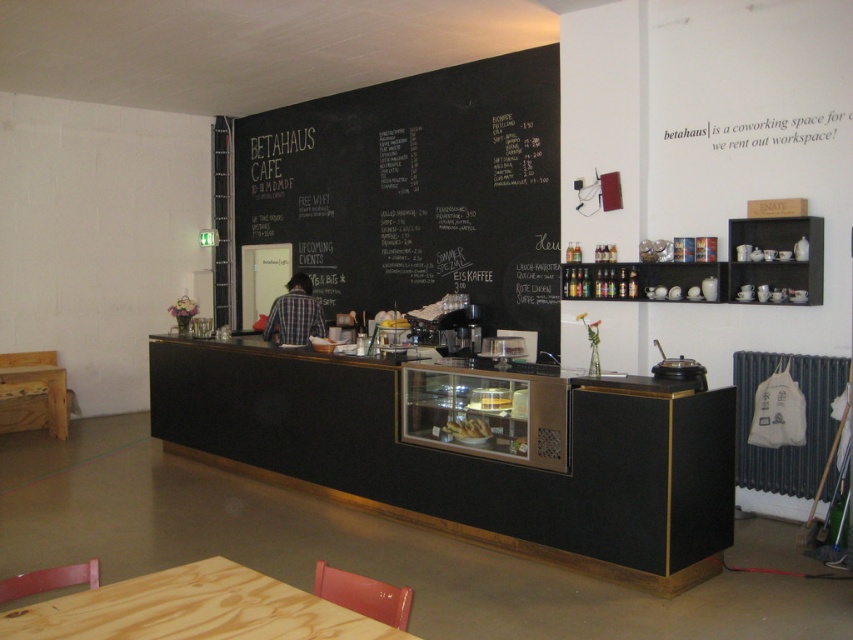
You are standing at the entrance of Betahaus Cafe and want to sit at the pine wood table at lower left. Which direction should you move to reach it?

The pine wood table at lower left is located at point (192, 609), so you should move towards the lower left direction to reach it.